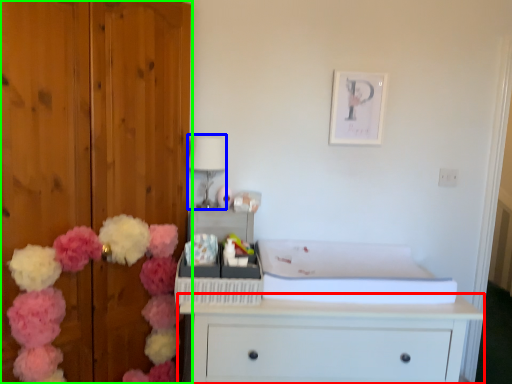
Question: Which is farther away from chest of drawers (highlighted by a red box)? lamp (highlighted by a blue box) or door (highlighted by a green box)?

Choices:
 (A) lamp
 (B) door

Answer: (A)